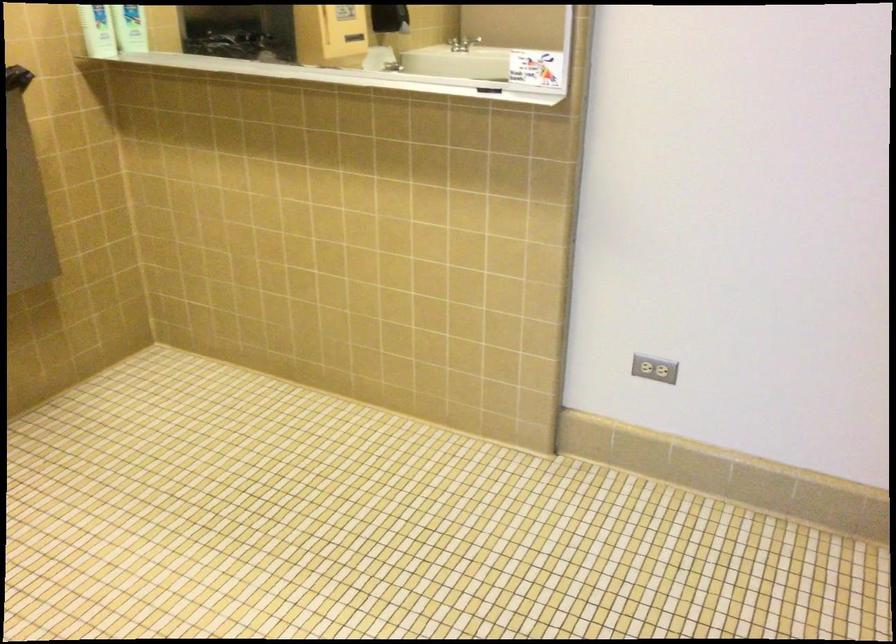
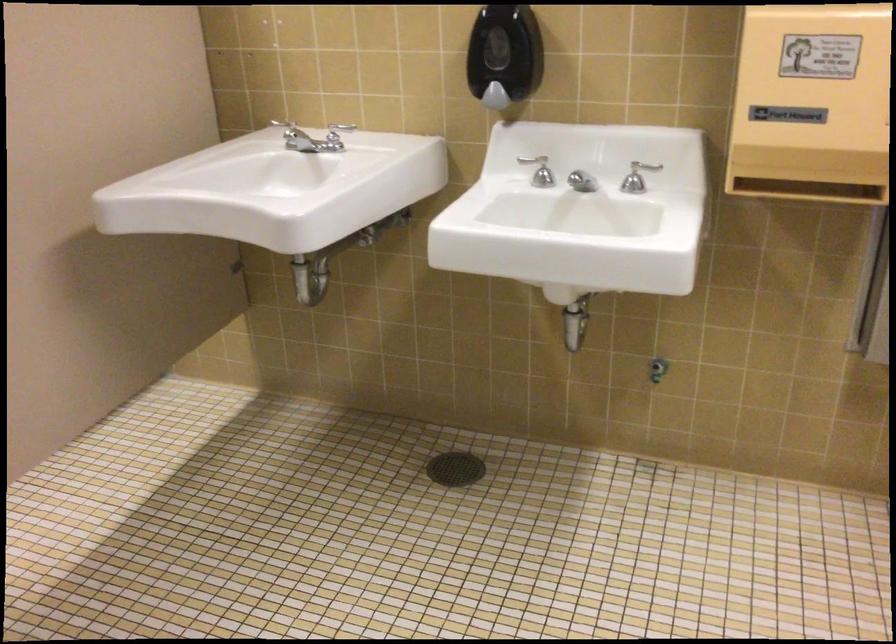
Based on the photo, first-person continuous shooting, in which direction is the camera rotating?

The rotation direction of the camera is left-down.